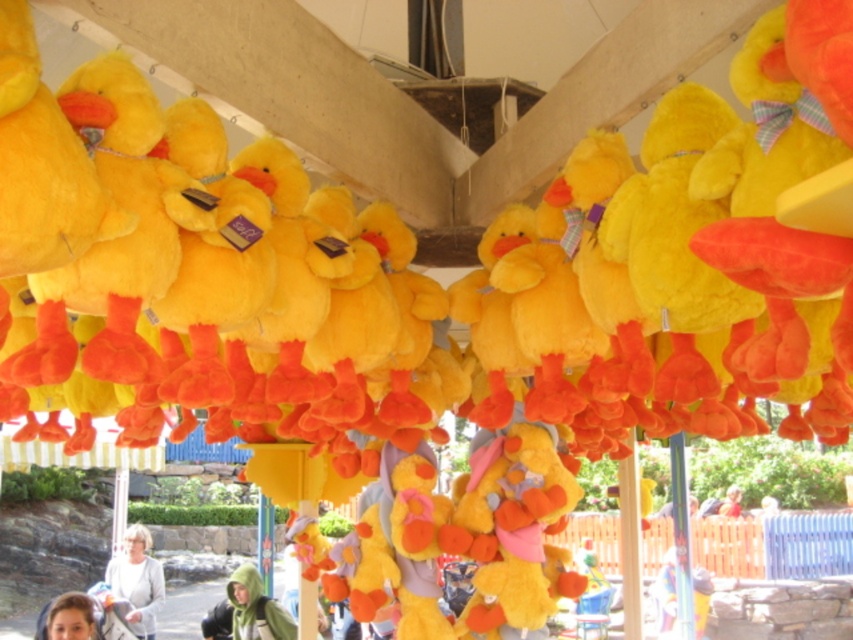
Which is above, matte green hoodie at lower center or smooth skin face at lower left?

smooth skin face at lower left is higher up.

Does matte green hoodie at lower center have a greater width compared to smooth skin face at lower left?

Correct, the width of matte green hoodie at lower center exceeds that of smooth skin face at lower left.

Who is more distant from viewer, (236, 608) or (59, 634)?

Point (236, 608)

The image size is (853, 640). I want to click on matte green hoodie at lower center, so click(x=247, y=611).

Between matte gray sweater at lower left and smooth skin face at lower left, which one is positioned lower?

Positioned lower is matte gray sweater at lower left.

Who is more forward, [146,577] or [97,634]?

Positioned in front is point [97,634].

You are a GUI agent. You are given a task and a screenshot of the screen. Output one action in this format:
    pyautogui.click(x=<x>, y=<y>)
    Task: Click on the matte gray sweater at lower left
    The height and width of the screenshot is (640, 853).
    Given the screenshot: What is the action you would take?
    pyautogui.click(x=137, y=580)

Is point (259, 596) positioned before point (136, 586)?

Yes, point (259, 596) is closer to viewer.

Between matte green hoodie at lower center and matte gray sweater at lower left, which one is positioned lower?

matte gray sweater at lower left

Is point (234, 595) positioned before point (155, 586)?

Yes, point (234, 595) is closer to viewer.

Where is `matte green hoodie at lower center`? matte green hoodie at lower center is located at coordinates (247, 611).